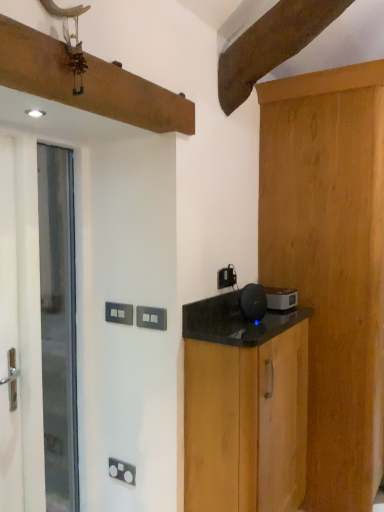
Question: Is black plastic electric outlet at upper center, which is the first electric outlet from back to front, facing away from light brown wood cabinet at right, marked as the second cabinetry in a left-to-right arrangement?

Choices:
 (A) yes
 (B) no

Answer: (B)

Question: Is black plastic electric outlet at upper center, which appears as the 3th electric outlet when viewed from the left, bigger than light brown wood cabinet at right, positioned as the 1th cabinetry in right-to-left order?

Choices:
 (A) no
 (B) yes

Answer: (A)

Question: From the image's perspective, is black plastic electric outlet at upper center, the 1th electric outlet from the top, beneath light brown wood cabinet at right, marked as the second cabinetry in a left-to-right arrangement?

Choices:
 (A) yes
 (B) no

Answer: (B)

Question: Can you confirm if black plastic electric outlet at upper center, the 3th electric outlet viewed from the front, is taller than light brown wood cabinet at right, positioned as the 1th cabinetry in right-to-left order?

Choices:
 (A) yes
 (B) no

Answer: (B)

Question: Is the position of black plastic electric outlet at upper center, which is the first electric outlet from back to front, less distant than that of light brown wood cabinet at right, positioned as the 1th cabinetry in right-to-left order?

Choices:
 (A) no
 (B) yes

Answer: (A)

Question: Considering the relative sizes of black plastic electric outlet at upper center, the 1th electric outlet from the top, and light brown wood cabinet at right, marked as the second cabinetry in a left-to-right arrangement, in the image provided, is black plastic electric outlet at upper center, the 1th electric outlet from the top, thinner than light brown wood cabinet at right, marked as the second cabinetry in a left-to-right arrangement,?

Choices:
 (A) yes
 (B) no

Answer: (A)

Question: Considering the relative sizes of black plastic speaker at center, the second appliance from the right, and white plastic switch at center, acting as the first electric outlet starting from the bottom, in the image provided, is black plastic speaker at center, the second appliance from the right, bigger than white plastic switch at center, acting as the first electric outlet starting from the bottom,?

Choices:
 (A) yes
 (B) no

Answer: (A)

Question: Considering the relative sizes of black plastic speaker at center, the second appliance from the right, and white plastic switch at center, the second electric outlet in the right-to-left sequence, in the image provided, is black plastic speaker at center, the second appliance from the right, shorter than white plastic switch at center, the second electric outlet in the right-to-left sequence,?

Choices:
 (A) no
 (B) yes

Answer: (A)

Question: Considering the relative positions of black plastic speaker at center, the 2th appliance when ordered from back to front, and white plastic switch at center, acting as the first electric outlet starting from the bottom, in the image provided, is black plastic speaker at center, the 2th appliance when ordered from back to front, to the right of white plastic switch at center, acting as the first electric outlet starting from the bottom, from the viewer's perspective?

Choices:
 (A) no
 (B) yes

Answer: (B)

Question: Is black plastic speaker at center, the 1th appliance viewed from the front, far away from white plastic switch at center, which appears as the second electric outlet when viewed from the left?

Choices:
 (A) yes
 (B) no

Answer: (B)

Question: Is black plastic speaker at center, the 1th appliance viewed from the front, wider than white plastic switch at center, acting as the first electric outlet starting from the bottom?

Choices:
 (A) yes
 (B) no

Answer: (A)

Question: From the image's perspective, would you say black plastic speaker at center, the 1th appliance viewed from the front, is shown under white plastic switch at center, which appears as the second electric outlet when viewed from the left?

Choices:
 (A) no
 (B) yes

Answer: (A)

Question: Is satin black speaker at right, which ranks as the second appliance in left-to-right order, wider than black wood cabinet at right, marked as the 2th cabinetry in a right-to-left arrangement?

Choices:
 (A) no
 (B) yes

Answer: (A)